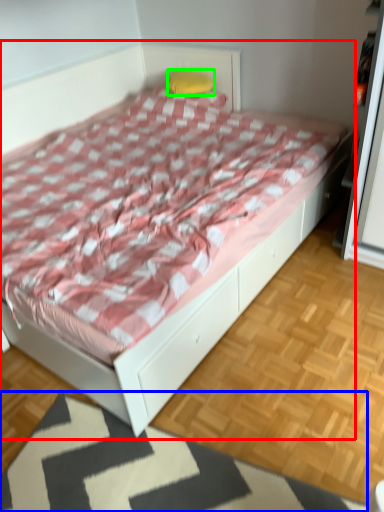
Question: Which object is positioned closest to bed (highlighted by a red box)? Select from mat (highlighted by a blue box) and pillow (highlighted by a green box).

Choices:
 (A) mat
 (B) pillow

Answer: (A)